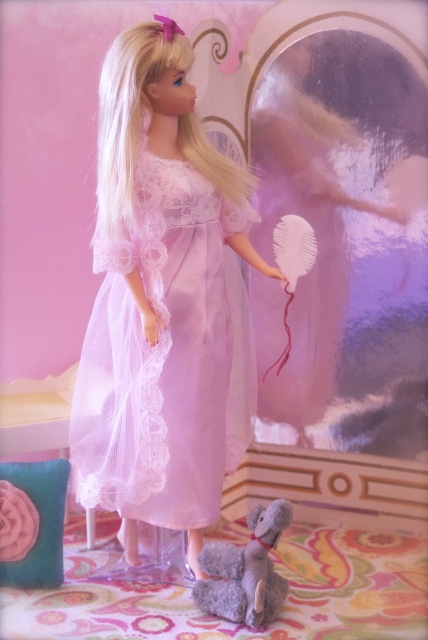
Question: Is lace fabric dress at center smaller than gray plush toy at lower center?

Choices:
 (A) yes
 (B) no

Answer: (B)

Question: From the image, what is the correct spatial relationship of lace fabric dress at center in relation to gray plush toy at lower center?

Choices:
 (A) below
 (B) above

Answer: (B)

Question: Among these points, which one is farthest from the camera?

Choices:
 (A) (198, 554)
 (B) (98, 477)

Answer: (A)

Question: Does lace fabric dress at center have a larger size compared to gray plush toy at lower center?

Choices:
 (A) yes
 (B) no

Answer: (A)